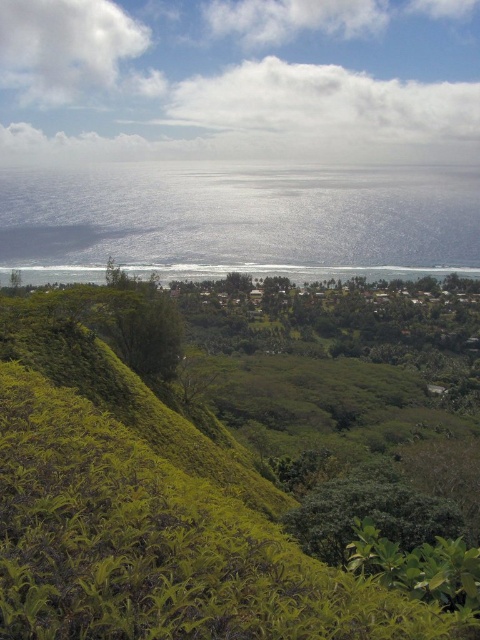
Is green leafy shrubs at lower left further to camera compared to blue reflective water at center?

That is False.

Who is higher up, green leafy shrubs at lower left or blue reflective water at center?

blue reflective water at center

Locate an element on the screen. green leafy shrubs at lower left is located at coordinates (146, 504).